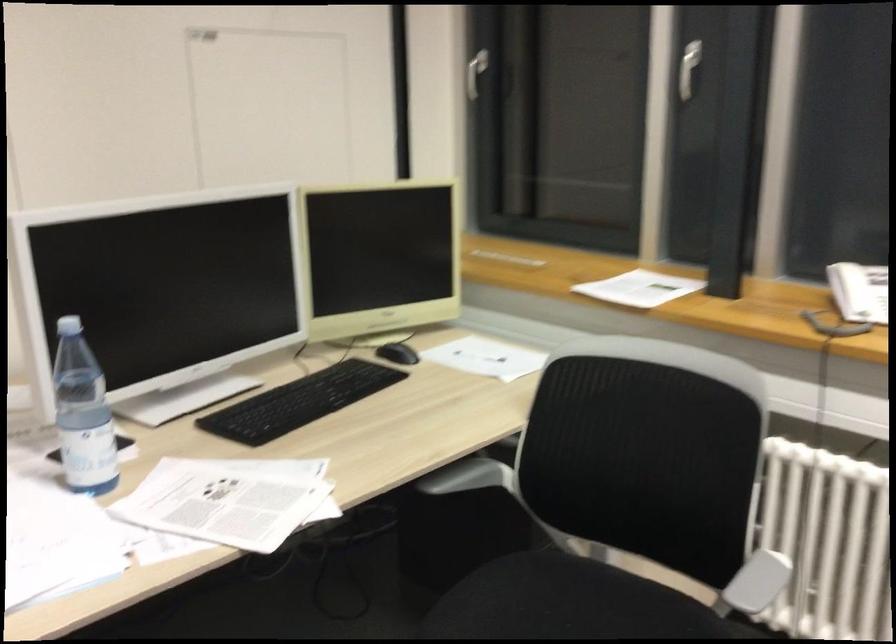
The location [82,413] corresponds to which object?

It corresponds to the plastic water bottle in the image.